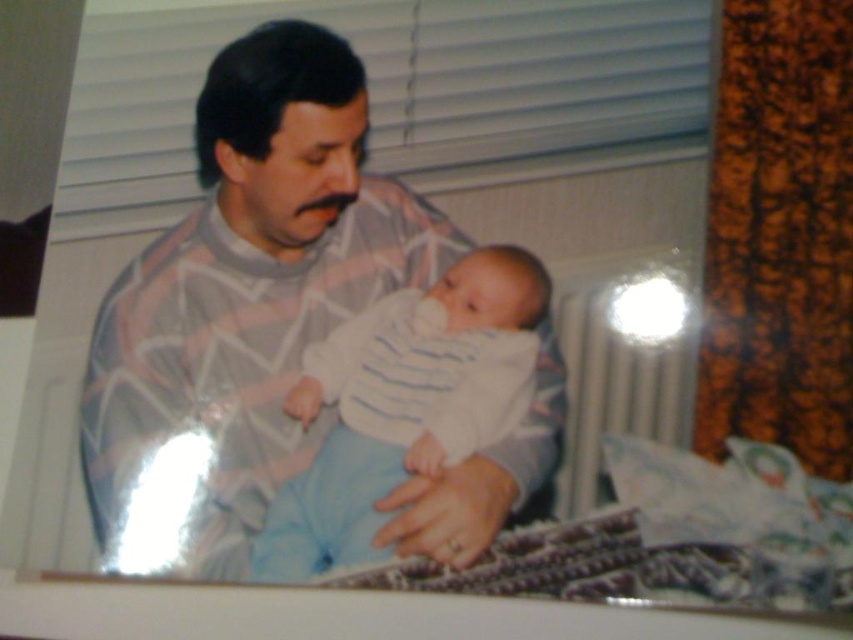
You are a photographer setting up a photo shoot. You have a camera with a lens that can only focus on objects wider than 30 cm. You see the striped sweater at center and the white striped fabric baby at center in the scene. Can both objects be in focus at the same time?

The striped sweater at center is wider than the white striped fabric baby at center. If the striped sweater at center is wider than 30 cm, then it can be in focus. However, since the baby might be narrower than 30 cm, it might not be in focus. Without exact measurements, it is uncertain if both can be in focus simultaneously.

You are a photographer who needs to capture a closeup shot of both the striped sweater at center and the white striped fabric baby at center. Given that your camera can only focus on objects within a 10 cm range, will you be able to capture both subjects in focus without adjusting the camera settings?

The striped sweater at center and white striped fabric baby at center are 8.96 centimeters apart, which is within the 10 cm range. Therefore, the camera can focus on both subjects without needing adjustments.